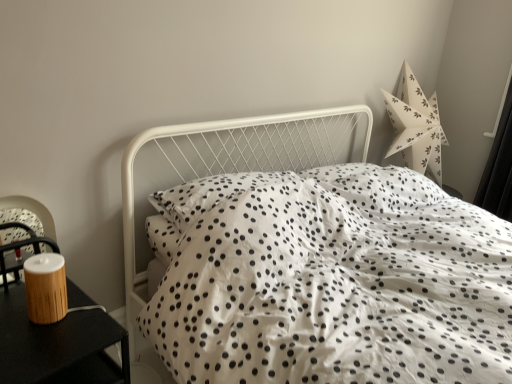
Question: From a real-world perspective, is wooden nightstand at left physically above white dotted fabric at center?

Choices:
 (A) yes
 (B) no

Answer: (B)

Question: Could white dotted fabric at center be considered to be inside wooden nightstand at left?

Choices:
 (A) no
 (B) yes

Answer: (A)

Question: Does wooden nightstand at left come behind white dotted fabric at center?

Choices:
 (A) yes
 (B) no

Answer: (A)

Question: Is wooden nightstand at left positioned beyond the bounds of white dotted fabric at center?

Choices:
 (A) no
 (B) yes

Answer: (B)

Question: From a real-world perspective, is wooden nightstand at left beneath white dotted fabric at center?

Choices:
 (A) no
 (B) yes

Answer: (B)

Question: From the image's perspective, is wooden nightstand at left located above white dotted fabric at center?

Choices:
 (A) yes
 (B) no

Answer: (B)

Question: From a real-world perspective, is white dotted fabric at center physically above black matte curtain at right?

Choices:
 (A) yes
 (B) no

Answer: (B)

Question: Can you confirm if white dotted fabric at center is smaller than black matte curtain at right?

Choices:
 (A) no
 (B) yes

Answer: (A)

Question: Can you confirm if white dotted fabric at center is bigger than black matte curtain at right?

Choices:
 (A) no
 (B) yes

Answer: (B)

Question: From a real-world perspective, is white dotted fabric at center under black matte curtain at right?

Choices:
 (A) no
 (B) yes

Answer: (B)

Question: Can you confirm if white dotted fabric at center is shorter than black matte curtain at right?

Choices:
 (A) yes
 (B) no

Answer: (A)

Question: Is white dotted fabric at center in front of black matte curtain at right?

Choices:
 (A) yes
 (B) no

Answer: (A)

Question: Does wooden nightstand at left have a greater width compared to black matte curtain at right?

Choices:
 (A) no
 (B) yes

Answer: (B)